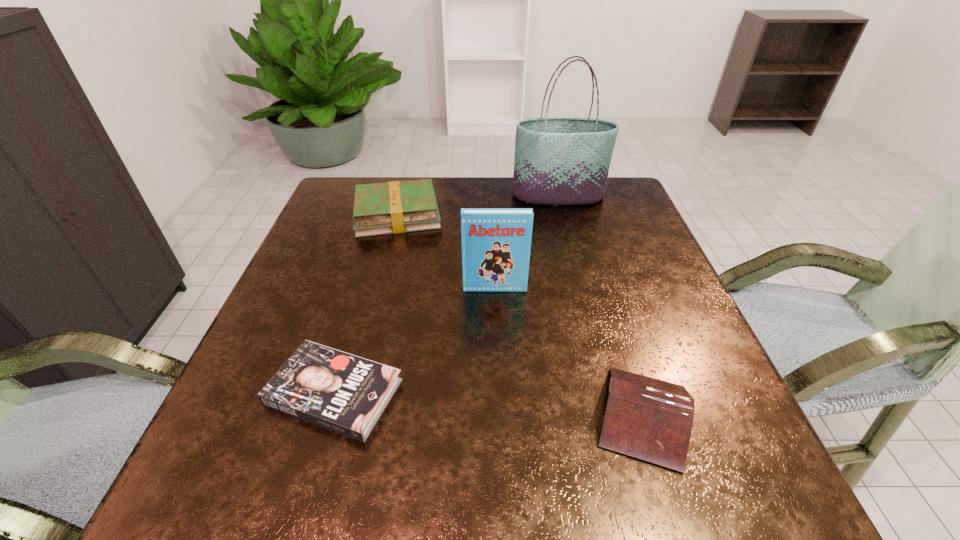
In the image, there is a desktop. At what (x,y) coordinates should I click in order to perform the action: click on free space at the left edge. Please return your answer as a coordinate pair (x, y). The width and height of the screenshot is (960, 540). Looking at the image, I should click on (312, 259).

At what (x,y) coordinates should I click in order to perform the action: click on free space at the right edge of the desktop. Please return your answer as a coordinate pair (x, y). Looking at the image, I should click on (602, 224).

Identify the location of vacant space at the near left corner of the desktop. (289, 496).

Where is `free spot between the rightmost book and the tallest object`? This screenshot has height=540, width=960. free spot between the rightmost book and the tallest object is located at coordinates (601, 306).

Find the location of a particular element. empty space that is in between the shortest object and the tallest book is located at coordinates (415, 340).

You are a GUI agent. You are given a task and a screenshot of the screen. Output one action in this format:
    pyautogui.click(x=<x>, y=<y>)
    Task: Click on the vacant region between the tallest object and the shortest book
    The height and width of the screenshot is (540, 960).
    Given the screenshot: What is the action you would take?
    pyautogui.click(x=446, y=294)

The height and width of the screenshot is (540, 960). I want to click on unoccupied area between the farthest book and the tallest object, so click(478, 206).

The image size is (960, 540). What are the coordinates of `unoccupied position between the farthest book and the shortest object` in the screenshot? It's located at click(366, 303).

I want to click on vacant space in between the farthest book and the shortest book, so click(x=366, y=303).

Locate an element on the screen. This screenshot has width=960, height=540. free space between the farthest book and the rightmost book is located at coordinates (520, 315).